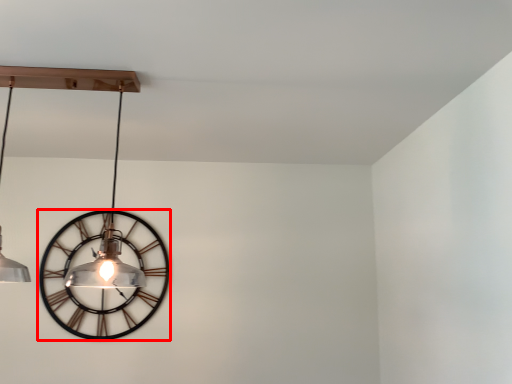
Question: From the image's perspective, considering the relative positions of wall clock (annotated by the red box) and lamp in the image provided, where is wall clock (annotated by the red box) located with respect to the staircase?

Choices:
 (A) above
 (B) below

Answer: (B)